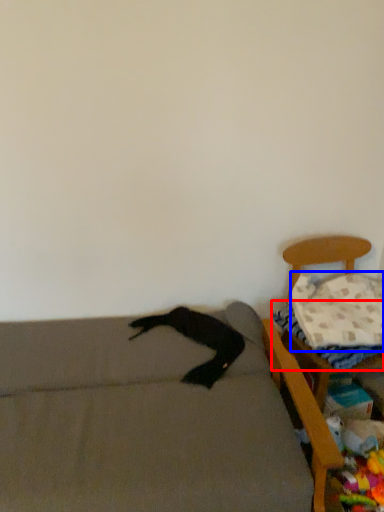
Question: Which object appears closest to the camera in this image, sheet (highlighted by a red box) or pillow (highlighted by a blue box)?

Choices:
 (A) sheet
 (B) pillow

Answer: (A)